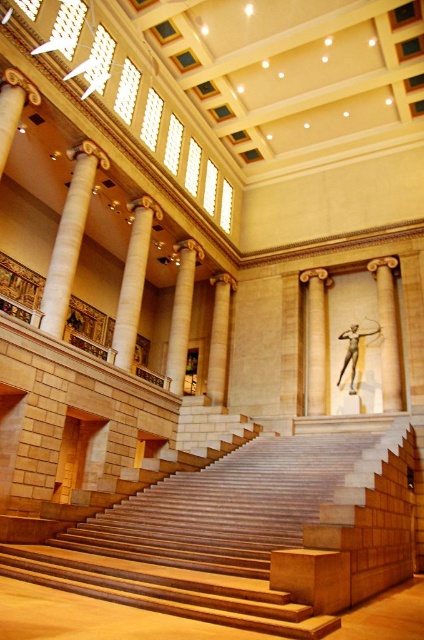
You are standing at the base of the staircase in the grand classical building. You notice two points marked on the floor in front of you. The first point is at coordinates point (136, 284) and the second is at point (190, 240). Which point is closer to you as you stand at the base of the staircase?

Point (136, 284) is closer to the viewer than point (190, 240).

You are standing at the bottom of the staircase and want to walk towards the statue. Which column should you pass first, the smooth stone column at center or the beige marble column at center?

The smooth stone column at center is to the left of the beige marble column at center, so you will pass the smooth stone column at center first as you walk towards the statue.

You are an architect designing a new exhibition space. You need to place a new sculpture that is 2 meters wide in the center of the room. Considering the beige marble column at center and the bronze statue at center, which object must be moved to accommodate the new sculpture?

The beige marble column at center must be moved because its width is less than the bronze statue at center, meaning it is narrower and easier to relocate to make space for the new sculpture.